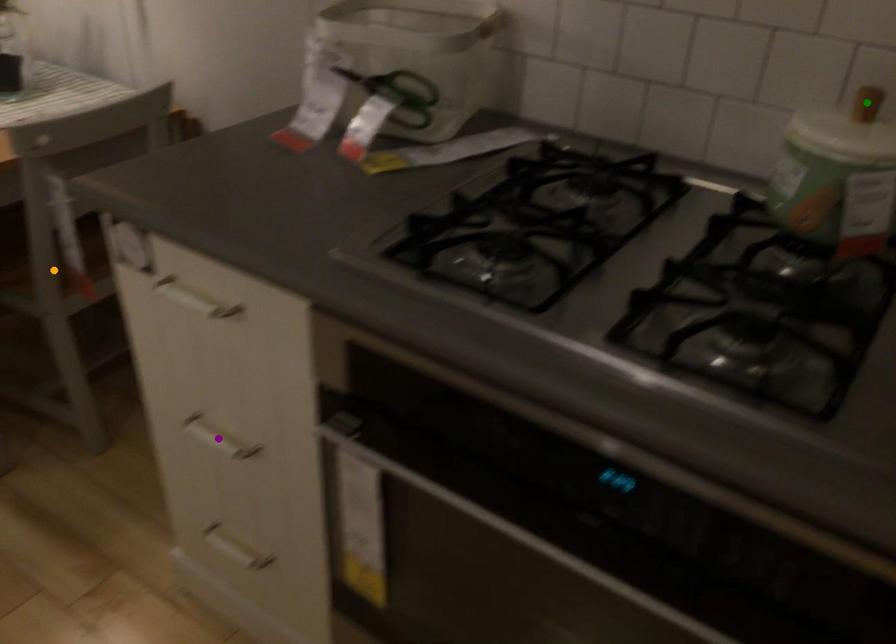
Order these from nearest to farthest:
purple point, green point, orange point

green point < purple point < orange point